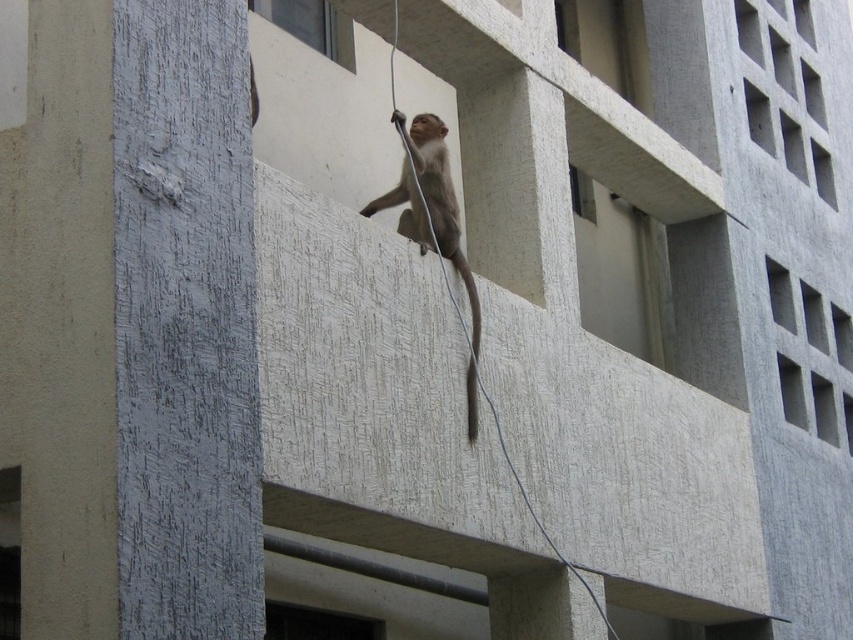
You are a wildlife photographer trying to capture a photo of the fuzzy gray monkey at center and the brown fur tail at center. If you want to ensure both subjects are fully visible in the frame, which one should you focus on first considering their sizes?

The fuzzy gray monkey at center is larger in width than the brown fur tail at center, so you should focus on the fuzzy gray monkey at center first to ensure it fits properly in the frame before adjusting for the smaller tail.

You are an architect analyzing the structural integrity of the building. The monkey is at position fuzzy gray monkey at center. Is the monkey located closer to the top or bottom of the structure?

The position of fuzzy gray monkey at center is at point (445, 228). Since the y coordinate is 0.524, which is above the midpoint of 0.5, the monkey is closer to the top of the structure.